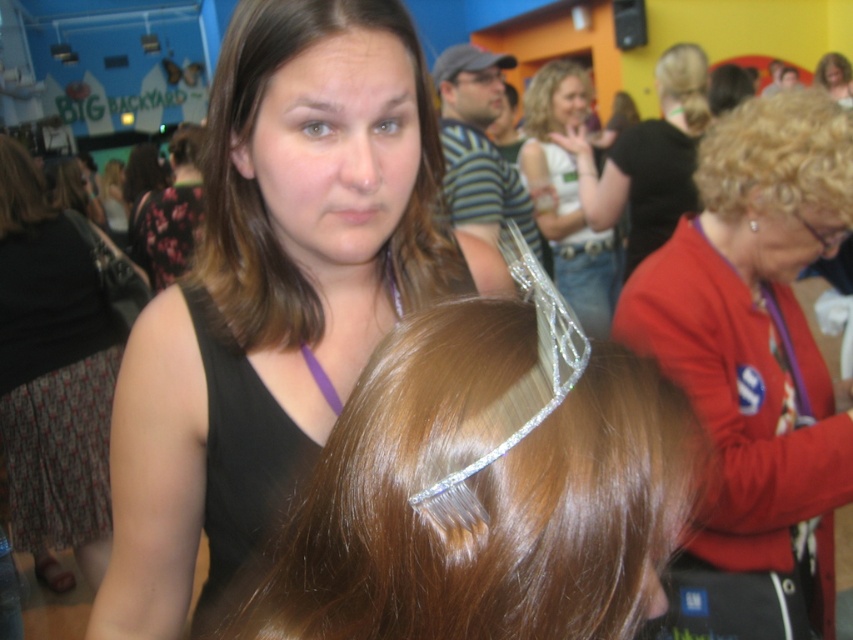
You are a photographer at the event and need to ensure that the matte black hair clip at upper center and the blonde curly hair at upper right are both visible in the photo. Considering their sizes, which object should you focus on to ensure both are in frame?

The matte black hair clip at upper center is larger in size compared to the blonde curly hair at upper right. To ensure both are visible, focus on the larger object, the matte black hair clip at upper center, as it requires more space in the frame.

You are a photographer at the event and want to ensure that both the brownsmoothhair at center and the clear plastic tiara at upper center are clearly visible in your photo. Which object should you focus on first to ensure both are in focus?

You should focus on the brownsmoothhair at center first because it is closer to the camera than the clear plastic tiara at upper center, ensuring both will be in focus when focusing on the closer object.